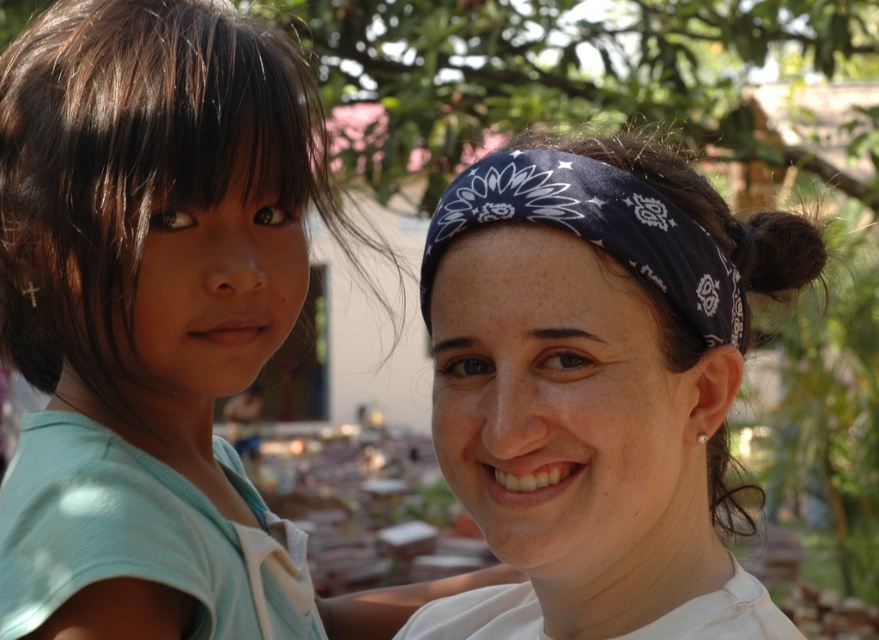
Looking at this image, you are a photographer trying to capture both the white cotton headband at upper right and the dark blue bandana at center in a single frame. Which accessory should you focus on first if you want to ensure both are clearly visible in your shot?

The white cotton headband at upper right is bigger than the dark blue bandana at center, so focusing on the white cotton headband at upper right first will help ensure both accessories are clearly visible in the frame.

You are a photographer trying to capture a photo of the two people in the scene. You want to ensure that the light blue fabric shirt at left and the white cotton headband at upper right are both clearly visible in the frame. Based on their positions, which object is higher up in the image?

The light blue fabric shirt at left is above the white cotton headband at upper right, so the light blue fabric shirt at left is higher up in the image.

You are a photographer adjusting your camera settings to capture a closeup of the white cotton headband at upper right. The camera can focus on objects within 3 feet. Will the headband be in focus?

The white cotton headband at upper right is 3.32 feet away from the camera, which is slightly beyond the 3 feet focus range. Therefore, the headband will not be in focus.